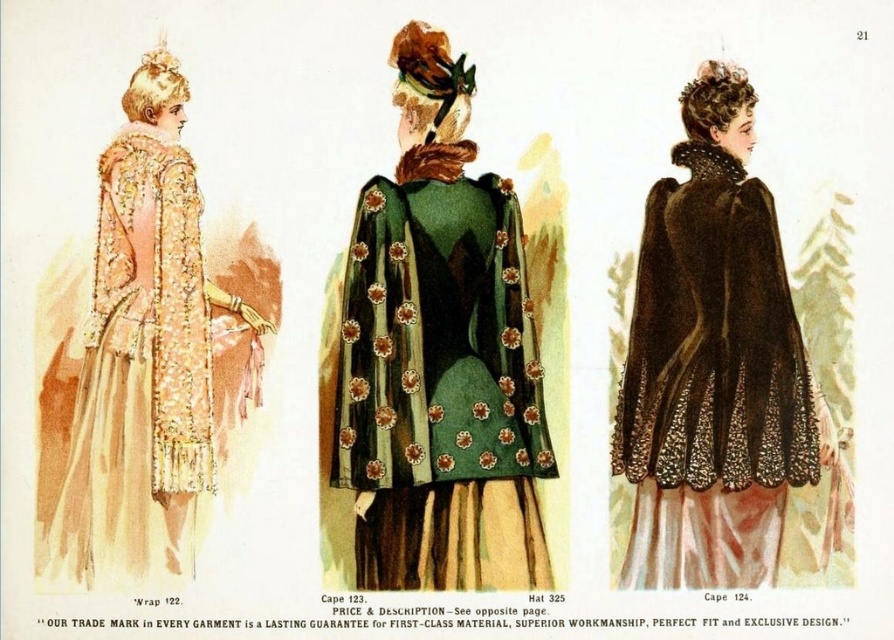
Question: Which object appears farthest from the camera in this image?

Choices:
 (A) matte gold cape at left
 (B) green velvet cape at center

Answer: (A)

Question: Does green velvet cape at center have a greater width compared to matte gold cape at left?

Choices:
 (A) yes
 (B) no

Answer: (B)

Question: Which is farther from the velvet cape at center?

Choices:
 (A) matte gold cape at left
 (B) green velvet cape at center

Answer: (A)

Question: Is green velvet cape at center above matte gold cape at left?

Choices:
 (A) yes
 (B) no

Answer: (B)

Question: Does green velvet cape at center have a greater width compared to matte gold cape at left?

Choices:
 (A) yes
 (B) no

Answer: (B)

Question: Which of the following is the closest to the observer?

Choices:
 (A) matte gold cape at left
 (B) green velvet cape at center
 (C) velvet cape at center

Answer: (B)